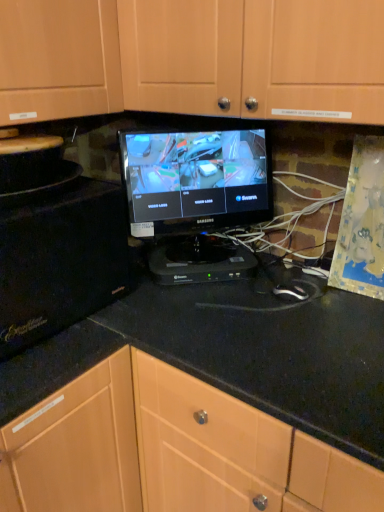
The height and width of the screenshot is (512, 384). I want to click on free space to the back side of black plastic mouse at center, so click(x=277, y=282).